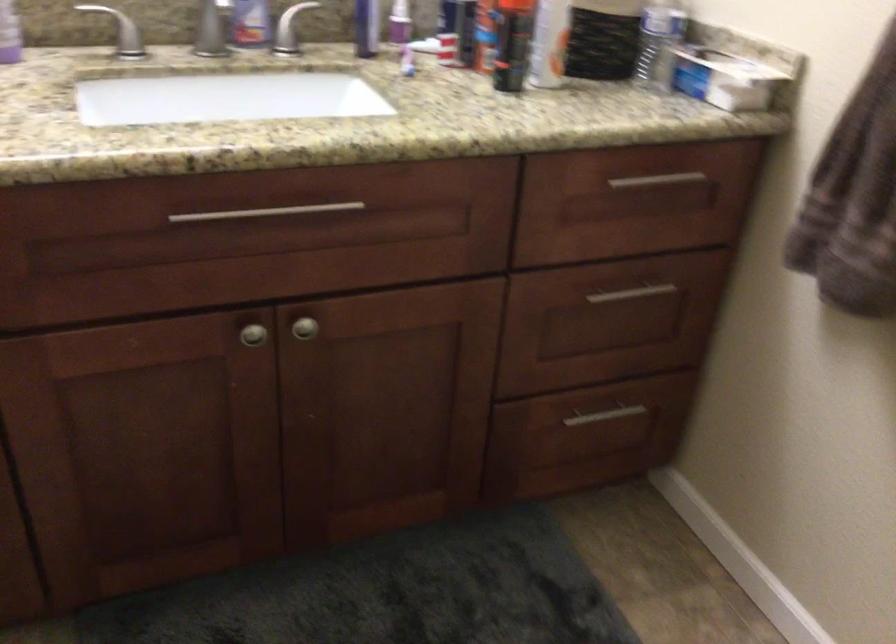
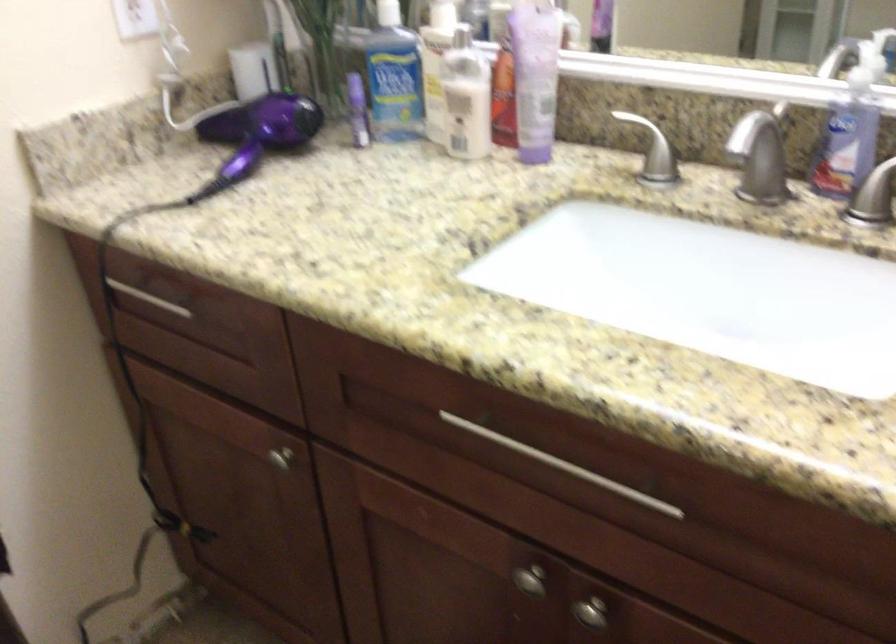
Question: The camera is either moving clockwise (left) or counter-clockwise (right) around the object. The first image is from the beginning of the video and the second image is from the end. Is the camera moving left or right when shooting the video?

Choices:
 (A) Left
 (B) Right

Answer: (B)